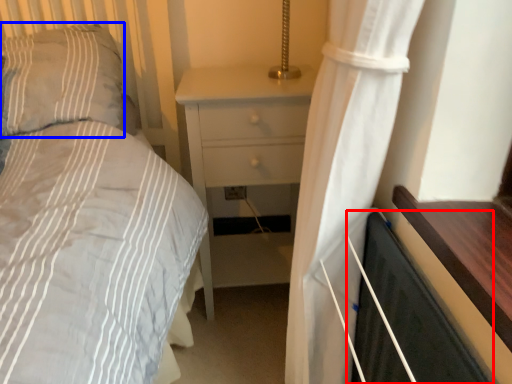
Question: Which of the following is the closest to the observer, screen door (highlighted by a red box) or pillow (highlighted by a blue box)?

Choices:
 (A) screen door
 (B) pillow

Answer: (A)